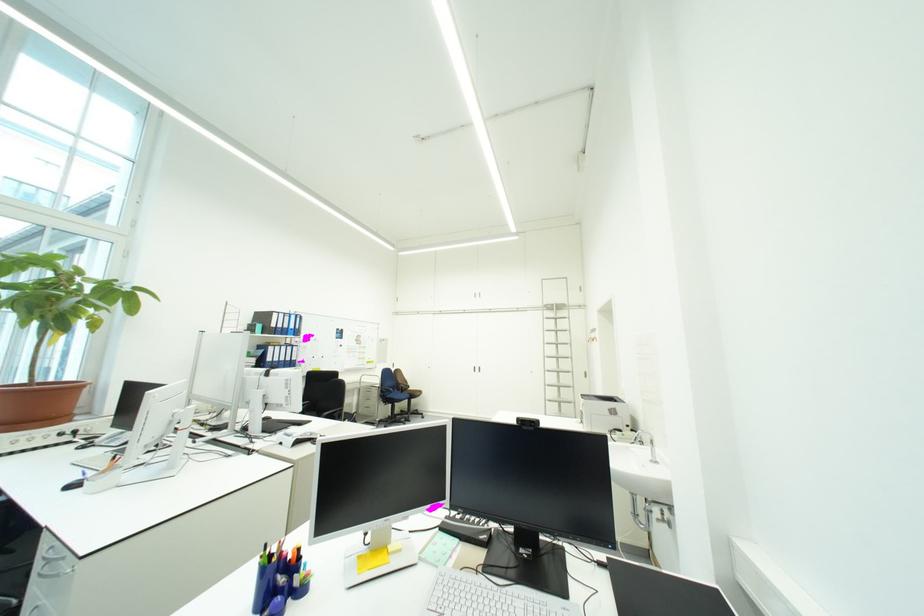
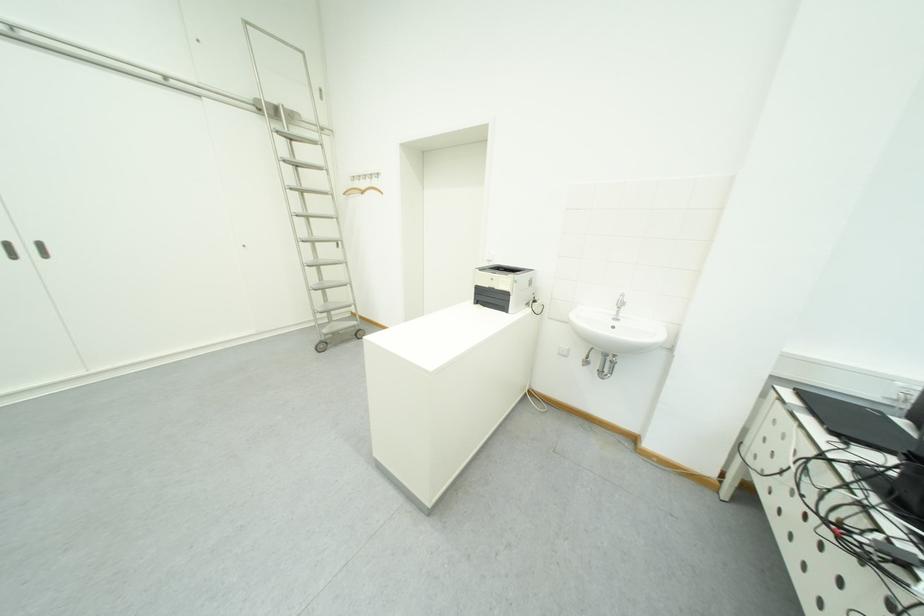
Where in the second image is the point corresponding to (x=488, y=371) from the first image?

(40, 252)